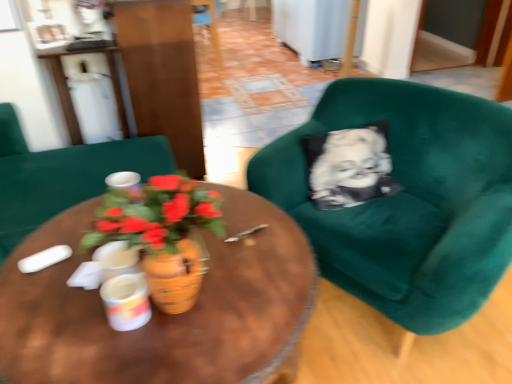
Question: Is velvet green armchair at right, which is the 1th chair from bottom to top, to the left or to the right of woodenobject at center in the image?

Choices:
 (A) left
 (B) right

Answer: (B)

Question: Looking at their shapes, would you say velvet green armchair at right, arranged as the 3th chair when viewed from the left, is wider or thinner than woodenobject at center?

Choices:
 (A) wide
 (B) thin

Answer: (B)

Question: Which is nearer to the wooden chair at center, marked as the 1th chair in a top-to-bottom arrangement?

Choices:
 (A) matte green armchair at center, acting as the 2th chair starting from the top
 (B) white glossy coffee cup at center, marked as the 2th coffee cup in a top-to-bottom arrangement
 (C) woodenobject at center
 (D) white glossy cup at center, arranged as the second coffee cup when ordered from the bottom
 (E) white glossy table at upper left

Answer: (E)

Question: Which of these objects is positioned farthest from the matte green armchair at center, the 2th chair positioned from the bottom?

Choices:
 (A) white glossy cup at center, arranged as the 1th coffee cup when viewed from the back
 (B) wooden chair at center, which is the second chair in right-to-left order
 (C) terracotta pot at center
 (D) white glossy coffee cup at center, the second coffee cup positioned from the back
 (E) velvet green armchair at right, the third chair viewed from the top

Answer: (B)